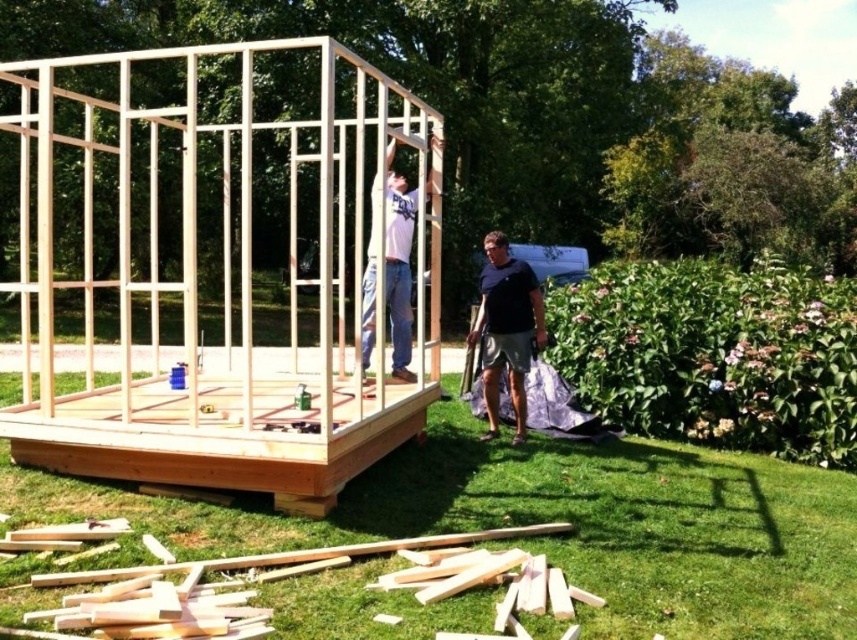
Question: Which is nearer to the light brown wood at lower left?

Choices:
 (A) black cotton shirt at center
 (B) natural wood shed at center

Answer: (A)

Question: Is black cotton shirt at center positioned before white matte shirt at center?

Choices:
 (A) no
 (B) yes

Answer: (A)

Question: From the image, what is the correct spatial relationship of natural wood shed at center in relation to black cotton shirt at center?

Choices:
 (A) left
 (B) right

Answer: (A)

Question: Can you confirm if natural wood shed at center is positioned above light brown wood at lower left?

Choices:
 (A) yes
 (B) no

Answer: (A)

Question: Among these objects, which one is farthest from the camera?

Choices:
 (A) black cotton shirt at center
 (B) light brown wood at lower left
 (C) natural wood shed at center
 (D) white matte shirt at center

Answer: (A)

Question: Among these points, which one is farthest from the camera?

Choices:
 (A) (399, 308)
 (B) (148, 612)

Answer: (A)